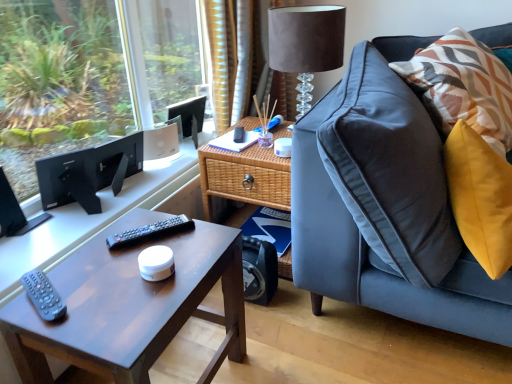
Question: From the image's perspective, is suede lampshade at upper right above matte brown coffee table at lower left?

Choices:
 (A) no
 (B) yes

Answer: (B)

Question: Can you confirm if suede lampshade at upper right is taller than matte brown coffee table at lower left?

Choices:
 (A) yes
 (B) no

Answer: (B)

Question: Is suede lampshade at upper right shorter than matte brown coffee table at lower left?

Choices:
 (A) no
 (B) yes

Answer: (B)

Question: Can you confirm if suede lampshade at upper right is smaller than matte brown coffee table at lower left?

Choices:
 (A) yes
 (B) no

Answer: (A)

Question: Does suede lampshade at upper right come behind matte brown coffee table at lower left?

Choices:
 (A) no
 (B) yes

Answer: (B)

Question: Relative to suede lampshade at upper right, is woven wood side table at center in front or behind?

Choices:
 (A) behind
 (B) front

Answer: (A)

Question: In terms of height, does woven wood side table at center look taller or shorter compared to suede lampshade at upper right?

Choices:
 (A) tall
 (B) short

Answer: (A)

Question: Choose the correct answer: Is woven wood side table at center inside suede lampshade at upper right or outside it?

Choices:
 (A) inside
 (B) outside

Answer: (B)

Question: From the image's perspective, is woven wood side table at center positioned above or below suede lampshade at upper right?

Choices:
 (A) below
 (B) above

Answer: (A)

Question: Visually, is black plastic remote at center, the second remote ordered from the bottom, positioned to the left or to the right of matte black computer desk at left?

Choices:
 (A) left
 (B) right

Answer: (B)

Question: Would you say black plastic remote at center, which appears as the 2th remote when viewed from the front, is inside or outside matte black computer desk at left?

Choices:
 (A) inside
 (B) outside

Answer: (B)

Question: Is black plastic remote at center, which appears as the 1th remote when viewed from the right, taller or shorter than matte black computer desk at left?

Choices:
 (A) tall
 (B) short

Answer: (B)

Question: Considering their positions, is black plastic remote at center, positioned as the 1th remote in top-to-bottom order, located in front of or behind matte black computer desk at left?

Choices:
 (A) behind
 (B) front

Answer: (B)

Question: Is point (188, 147) positioned closer to the camera than point (49, 281)?

Choices:
 (A) closer
 (B) farther

Answer: (B)

Question: From a real-world perspective, is matte black computer desk at left positioned above or below black plastic remote at lower left, the 1th remote in the bottom-to-top sequence?

Choices:
 (A) below
 (B) above

Answer: (A)